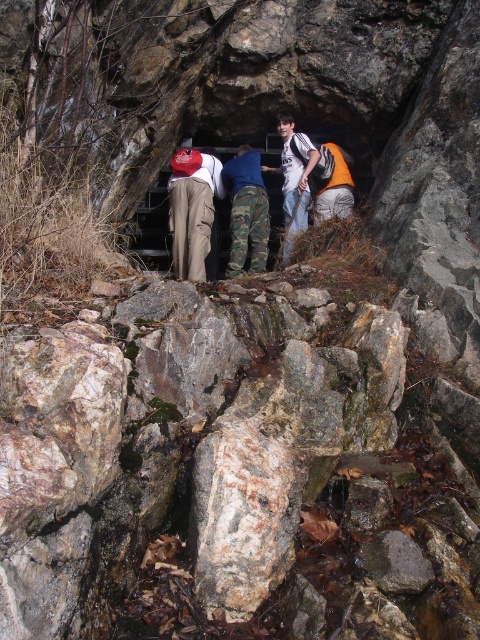
Question: Does camo pants at center appear over camouflage pants at center?

Choices:
 (A) yes
 (B) no

Answer: (B)

Question: Which object appears closest to the camera in this image?

Choices:
 (A) camouflage pants at center
 (B) camo pants at center

Answer: (B)

Question: Is camo pants at center smaller than camouflage pants at center?

Choices:
 (A) yes
 (B) no

Answer: (B)

Question: Which object is the closest to the camouflage pants at center?

Choices:
 (A) camo pants at center
 (B) matte khaki pants at center

Answer: (A)

Question: Can you confirm if camo pants at center is bigger than camouflage pants at center?

Choices:
 (A) no
 (B) yes

Answer: (B)

Question: Based on their relative distances, which object is farther from the matte khaki pants at center?

Choices:
 (A) camouflage pants at center
 (B) camo pants at center

Answer: (A)